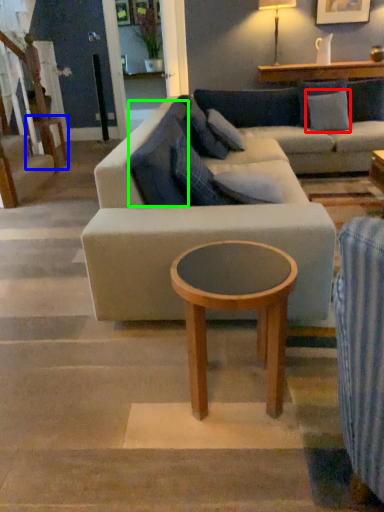
Question: Based on their relative distances, which object is nearer to pillow (highlighted by a red box)? Choose from table (highlighted by a blue box) and pillow (highlighted by a green box).

Choices:
 (A) table
 (B) pillow

Answer: (B)